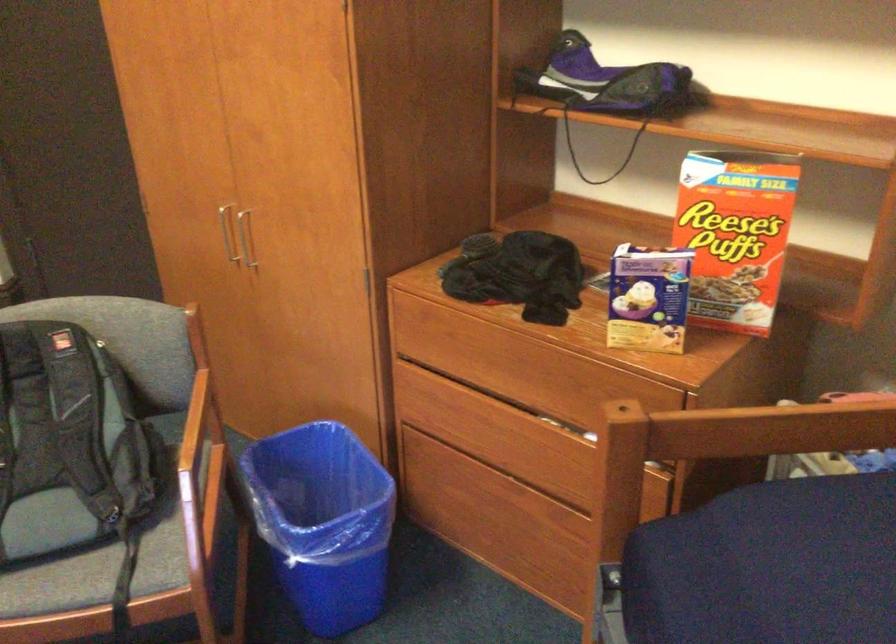
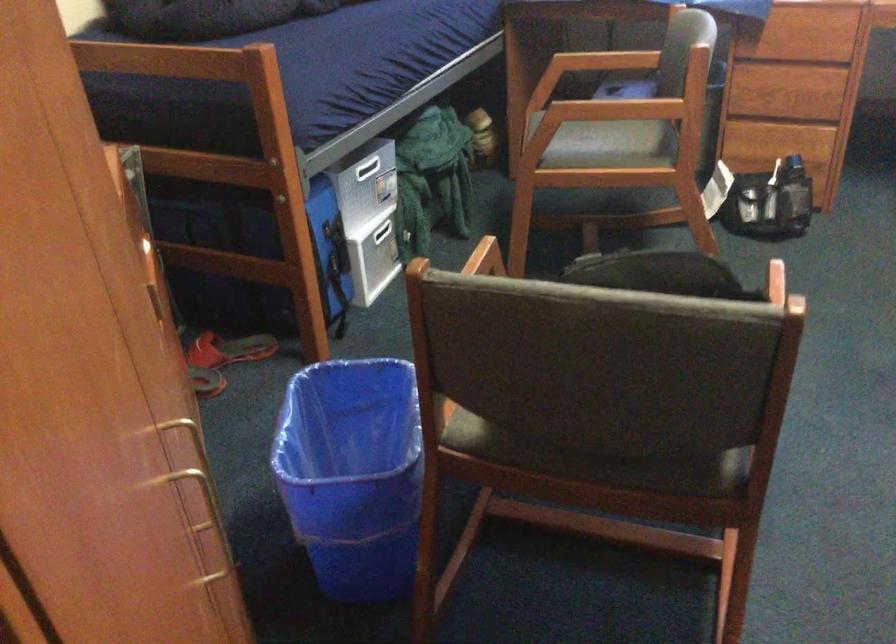
The point at (x=194, y=240) is marked in the first image. Where is the corresponding point in the second image?

(199, 494)